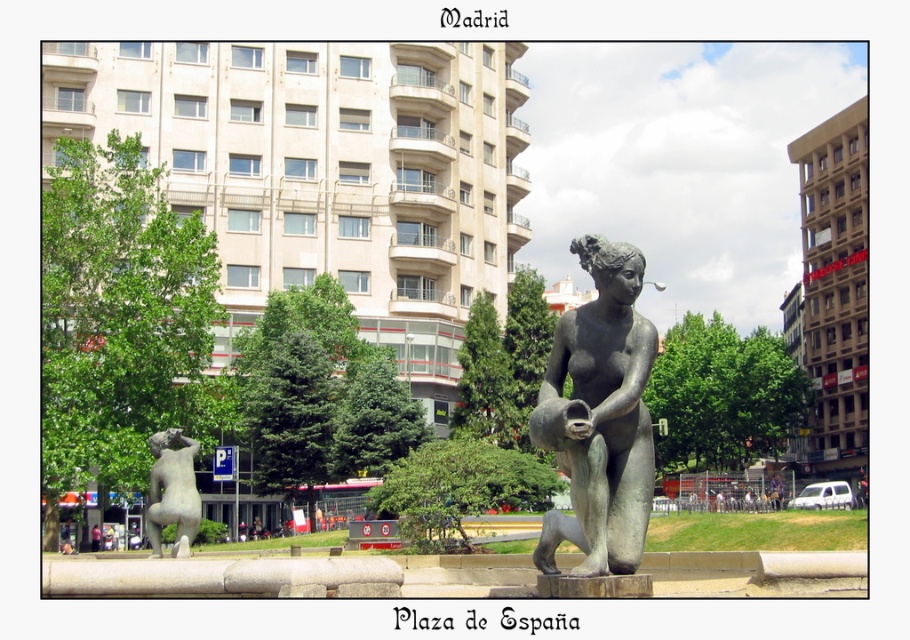
Question: Is bronze statue at center above bronze statue at lower left?

Choices:
 (A) yes
 (B) no

Answer: (A)

Question: Where is bronze statue at center located in relation to bronze statue at lower left in the image?

Choices:
 (A) below
 (B) above

Answer: (B)

Question: Is bronze statue at center closer to the viewer compared to bronze statue at lower left?

Choices:
 (A) no
 (B) yes

Answer: (B)

Question: Among these objects, which one is nearest to the camera?

Choices:
 (A) bronze statue at center
 (B) bronze statue at lower left

Answer: (A)